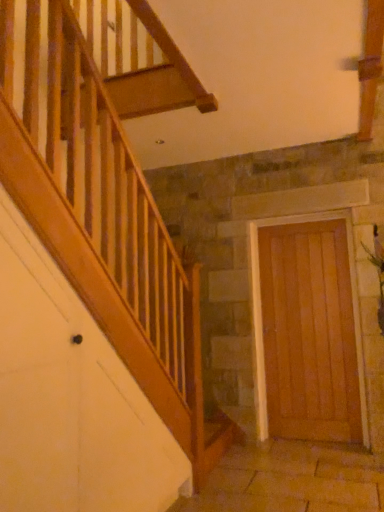
What do you see at coordinates (378, 272) in the screenshot? I see `green leafy plant at right` at bounding box center [378, 272].

Identify the location of green leafy plant at right. The height and width of the screenshot is (512, 384). (378, 272).

Measure the distance between wooden door at right and camera.

A distance of 3.48 meters exists between wooden door at right and camera.

At what (x,y) coordinates should I click in order to perform the action: click on wooden door at right. Please return your answer as a coordinate pair (x, y). Looking at the image, I should click on (263, 312).

What do you see at coordinates (263, 312) in the screenshot? The image size is (384, 512). I see `wooden door at right` at bounding box center [263, 312].

This screenshot has height=512, width=384. I want to click on green leafy plant at right, so click(378, 272).

Does green leafy plant at right appear on the left side of wooden door at right?

No, green leafy plant at right is not to the left of wooden door at right.

Is green leafy plant at right positioned in front of wooden door at right?

Yes, it is in front of wooden door at right.

Is point (383, 284) closer or farther from the camera than point (262, 283)?

Clearly, point (383, 284) is closer to the camera than point (262, 283).

From the image's perspective, which is below, green leafy plant at right or wooden door at right?

wooden door at right.

From a real-world perspective, does green leafy plant at right stand above wooden door at right?

Correct, in the physical world, green leafy plant at right is higher than wooden door at right.

Which object is wider, green leafy plant at right or wooden door at right?

green leafy plant at right is wider.

Looking at this image, is green leafy plant at right shorter than wooden door at right?

Indeed, green leafy plant at right has a lesser height compared to wooden door at right.

Looking at this image, which of these two, green leafy plant at right or wooden door at right, is smaller?

Smaller between the two is green leafy plant at right.

Is green leafy plant at right spatially inside wooden door at right, or outside of it?

green leafy plant at right is outside wooden door at right.

From the picture: Would you consider green leafy plant at right to be distant from wooden door at right?

That's not correct — green leafy plant at right is a little close to wooden door at right.

Could you tell me if green leafy plant at right is turned towards wooden door at right?

No, green leafy plant at right is not facing towards wooden door at right.

This screenshot has width=384, height=512. In order to click on door below the green leafy plant at right (from the image's perspective) in this screenshot , I will do `click(263, 312)`.

Which object is positioned more to the left, wooden door at right or green leafy plant at right?

wooden door at right.

Does wooden door at right lie in front of green leafy plant at right?

No, it is behind green leafy plant at right.

Does point (266, 399) appear closer or farther from the camera than point (376, 251)?

Point (266, 399) is positioned farther from the camera compared to point (376, 251).

From the picture: From the image's perspective, is wooden door at right under green leafy plant at right?

Answer: Yes.

From a real-world perspective, between wooden door at right and green leafy plant at right, who is vertically higher?

green leafy plant at right, from a real-world perspective.

Considering the sizes of wooden door at right and green leafy plant at right in the image, is wooden door at right wider or thinner than green leafy plant at right?

Clearly, wooden door at right has less width compared to green leafy plant at right.

Is wooden door at right shorter than green leafy plant at right?

In fact, wooden door at right may be taller than green leafy plant at right.

Considering the sizes of objects wooden door at right and green leafy plant at right in the image provided, who is smaller, wooden door at right or green leafy plant at right?

green leafy plant at right.

Is wooden door at right not inside green leafy plant at right?

Absolutely, wooden door at right is external to green leafy plant at right.

Is wooden door at right not near green leafy plant at right?

No, wooden door at right is in close proximity to green leafy plant at right.

Could you tell me if wooden door at right is facing green leafy plant at right?

No, wooden door at right is not turned towards green leafy plant at right.

How far apart are wooden door at right and green leafy plant at right?

A distance of 21.80 inches exists between wooden door at right and green leafy plant at right.

Locate an element on the screen. The height and width of the screenshot is (512, 384). plant above the wooden door at right (from a real-world perspective) is located at coordinates (378, 272).

You are a GUI agent. You are given a task and a screenshot of the screen. Output one action in this format:
    pyautogui.click(x=<x>, y=<y>)
    Task: Click on the plant located on the right of wooden door at right
    The width and height of the screenshot is (384, 512).
    Given the screenshot: What is the action you would take?
    pyautogui.click(x=378, y=272)

Where is `door located on the left of green leafy plant at right`? This screenshot has width=384, height=512. door located on the left of green leafy plant at right is located at coordinates (263, 312).